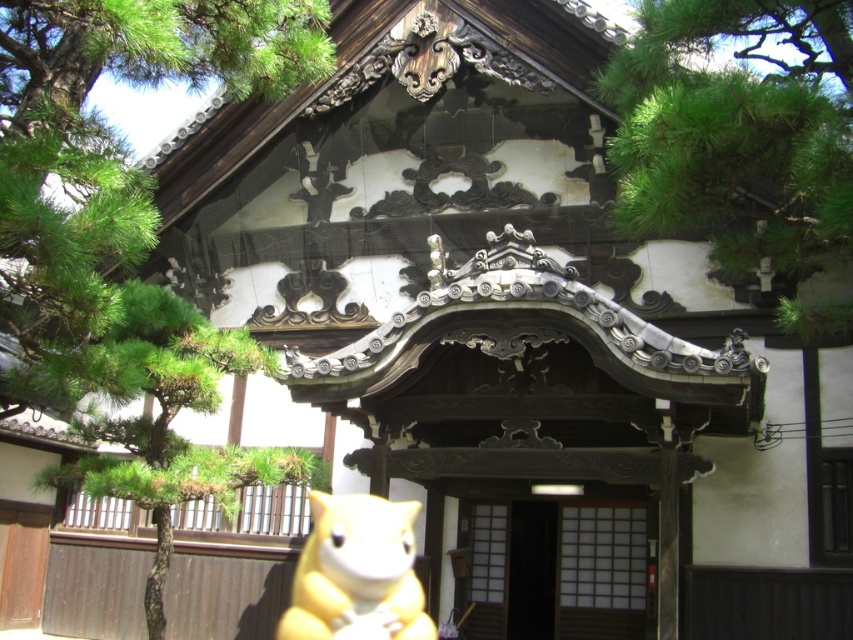
You are standing in front of the traditional Japanese building and see the green textured tree at left and the yellow plush toy at lower center. Which object is higher from the ground?

The green textured tree at left is higher from the ground than the yellow plush toy at lower center because it is positioned above it.

You are standing in front of the traditional Japanese building and want to take a photo of the yellow plush toy at lower center without the green textured tree at left blocking the view. Is this possible?

The green textured tree at left is in front of the yellow plush toy at lower center, so you cannot take a photo of the yellow plush toy at lower center without the tree blocking the view.

You are standing in front of the traditional Japanese building and want to place a small lantern between the green pine tree at upper left and the yellow plush toy at lower center. Which object should the lantern be closer to if it needs to be placed closer to the taller object?

The green pine tree at upper left is taller than the yellow plush toy at lower center, so the lantern should be placed closer to the green pine tree at upper left.